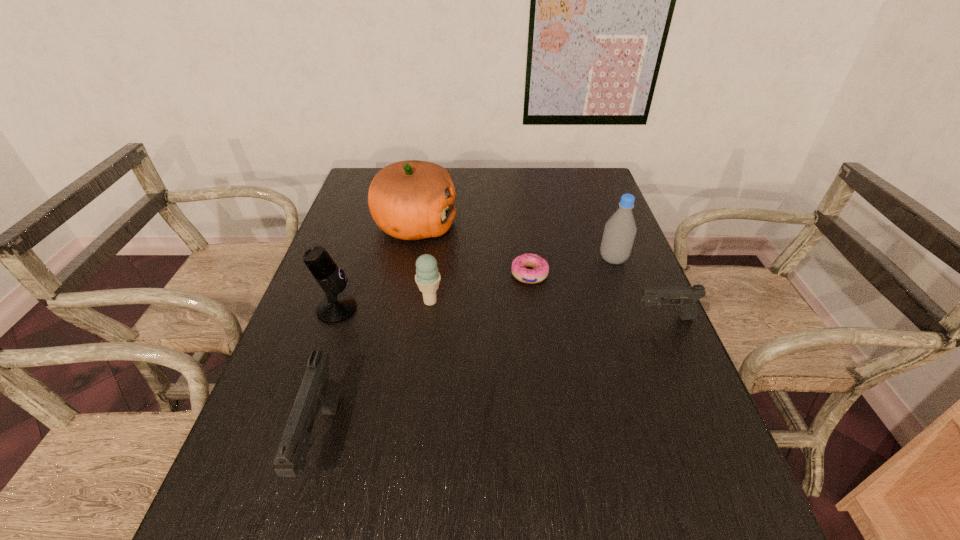
I want to click on pumpkin located in the left edge section of the desktop, so click(x=410, y=200).

I want to click on microphone positioned at the left edge, so [x=335, y=308].

Where is `pistol situated at the right edge`? Image resolution: width=960 pixels, height=540 pixels. pistol situated at the right edge is located at coordinates (685, 297).

In order to click on bottle at the right edge in this screenshot , I will do `click(620, 230)`.

Locate an element on the screen. object that is positioned at the near left corner is located at coordinates (318, 391).

Locate an element on the screen. The width and height of the screenshot is (960, 540). free space at the far edge is located at coordinates (485, 177).

This screenshot has height=540, width=960. In order to click on vacant space at the near edge in this screenshot , I will do `click(522, 483)`.

Find the location of `vacant point at the left edge`. vacant point at the left edge is located at coordinates (292, 388).

Identify the location of vacant space at the right edge. The image size is (960, 540). (646, 355).

This screenshot has width=960, height=540. In the image, there is a desktop. Identify the location of vacant space at the near right corner. (700, 467).